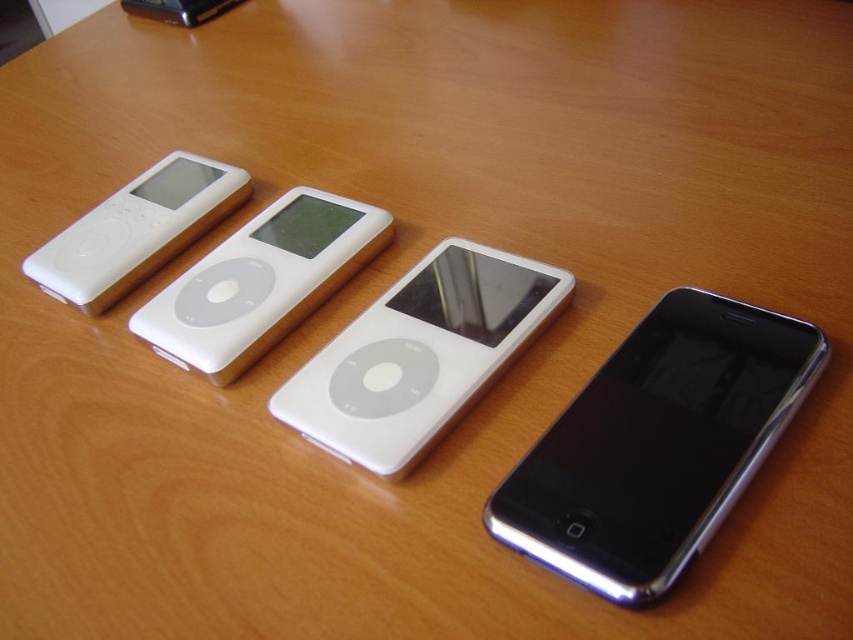
Does black glossy smartphone at lower right have a smaller size compared to white glossy ipod at left?

Correct, black glossy smartphone at lower right occupies less space than white glossy ipod at left.

Between black glossy smartphone at lower right and white glossy ipod at left, which one is positioned higher?

white glossy ipod at left

Between point (688, 358) and point (32, 266), which one is positioned behind?

The point (32, 266) is behind.

Where is `black glossy smartphone at lower right`? This screenshot has height=640, width=853. black glossy smartphone at lower right is located at coordinates (659, 444).

Is point (697, 520) in front of point (344, 429)?

Yes.

Is point (637, 352) farther from viewer compared to point (287, 397)?

No, it is in front of (287, 397).

Where is `black glossy smartphone at lower right`? Image resolution: width=853 pixels, height=640 pixels. black glossy smartphone at lower right is located at coordinates (659, 444).

Can you confirm if sleek white ipod at center is positioned below white glossy ipod at left?

Correct, sleek white ipod at center is located below white glossy ipod at left.

Does point (268, 406) lie behind point (125, 289)?

No.

This screenshot has height=640, width=853. I want to click on sleek white ipod at center, so click(421, 355).